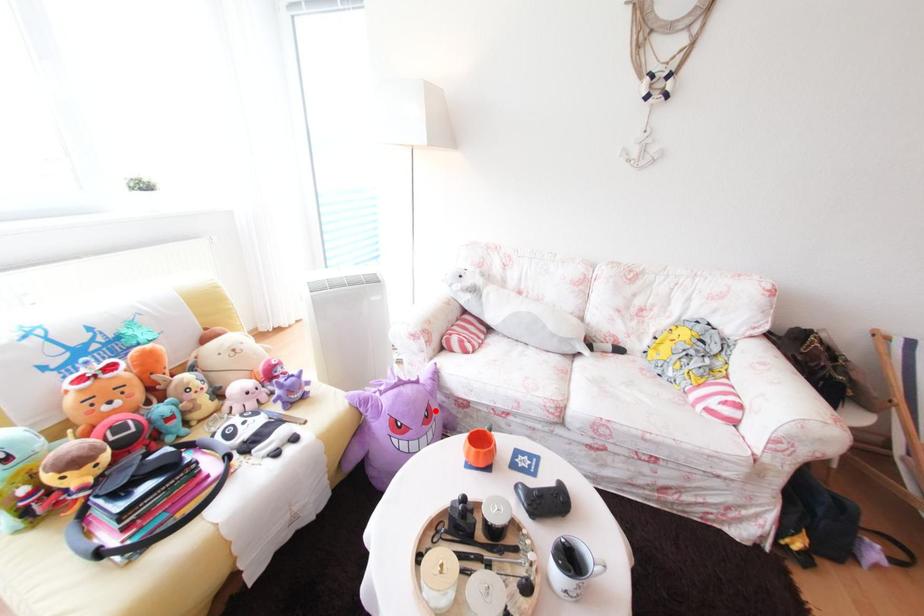
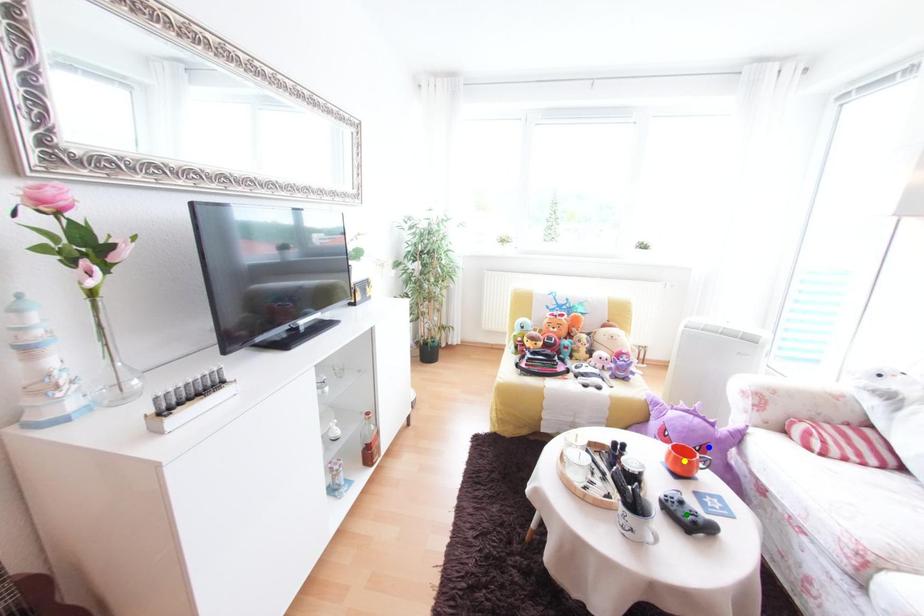
Question: I am providing you with two images of the same scene from different viewpoints. A red point is marked on the first image. You are given multiple points on the second image. Which point in image 2 represents the same 3d spot as the red point in image 1?

Choices:
 (A) blue point
 (B) yellow point
 (C) green point

Answer: (A)